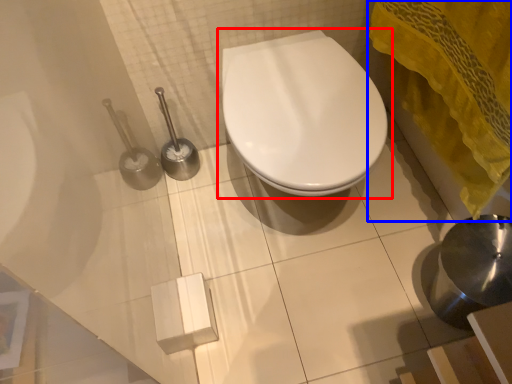
Question: Among these objects, which one is nearest to the camera, toilet (highlighted by a red box) or bath towel (highlighted by a blue box)?

Choices:
 (A) toilet
 (B) bath towel

Answer: (B)